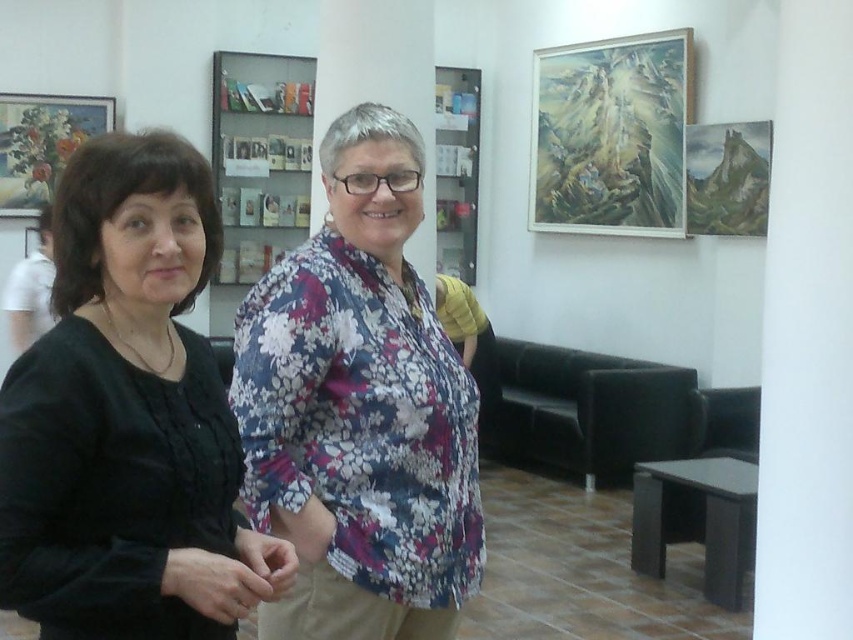
Question: Which object is the farthest from the white shirt at left?

Choices:
 (A) floral fabric blouse at center
 (B) oil painting at upper right
 (C) wooden picture frame at upper left

Answer: (B)

Question: Does oil painting at upper right lie behind matte wooden picture frame at upper right?

Choices:
 (A) no
 (B) yes

Answer: (B)

Question: Does oil painting at upper right appear under wooden picture frame at upper left?

Choices:
 (A) no
 (B) yes

Answer: (A)

Question: Estimate the real-world distances between objects in this image. Which object is closer to the oil painting at upper right?

Choices:
 (A) wooden picture frame at upper left
 (B) black matte shirt at left

Answer: (A)

Question: Considering the relative positions of black matte shirt at left and floral fabric blouse at center in the image provided, where is black matte shirt at left located with respect to floral fabric blouse at center?

Choices:
 (A) above
 (B) below

Answer: (B)

Question: Which point appears farthest from the camera in this image?

Choices:
 (A) (299, 440)
 (B) (550, 192)
 (C) (49, 296)

Answer: (B)